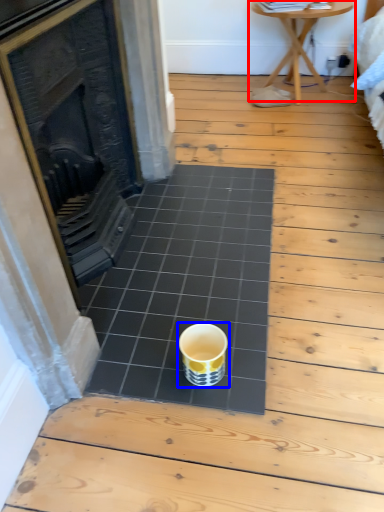
Question: Which of the following is the closest to the observer, table (highlighted by a red box) or coffee cup (highlighted by a blue box)?

Choices:
 (A) table
 (B) coffee cup

Answer: (B)